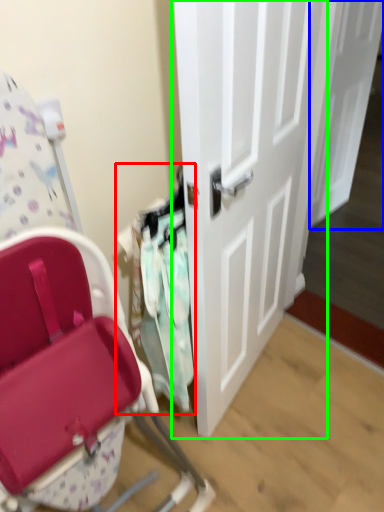
Question: Which object is the farthest from laundry (highlighted by a red box)? Choose among these: door (highlighted by a blue box) or door (highlighted by a green box).

Choices:
 (A) door
 (B) door

Answer: (A)